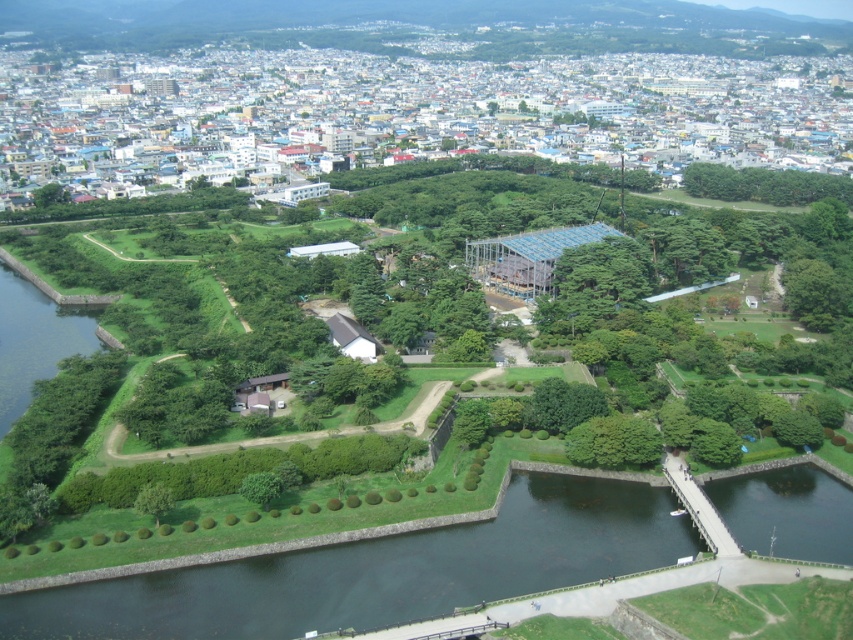
You are standing at the construction site in the park and want to determine which of the two points, point (540,524) or point (631,451), is nearer to you. Based on the aerial view provided, which point is closer?

Point (540,524) is closer to the camera than point (631,451), so it is the nearer point.

You are a landscape architect planning to install a new walkway in the park. The walkway must be placed between the green grassy river at lower center and the green leafy tree at center. Which side of the walkway should be closer to the river to ensure it accommodates the widest possible pathway? Please explain your reasoning based on the spatial relationship between the two objects.

The walkway should be closer to the green leafy tree at center because the green grassy river at lower center is wider than the green leafy tree at center. This allows the pathway to utilize the broader space provided by the river, ensuring a wider walkway.